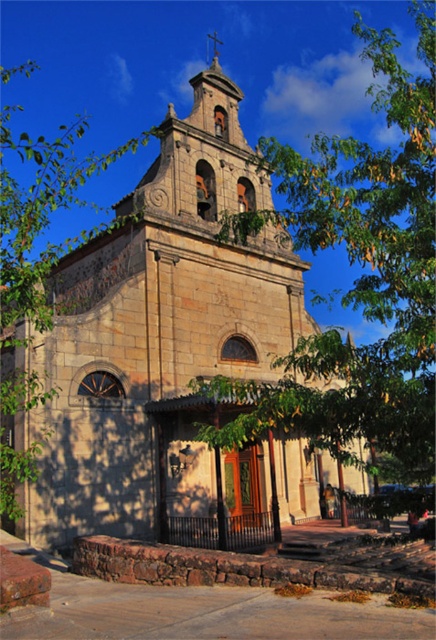
Who is taller, green leafy tree at center or green leafy tree at left?

With more height is green leafy tree at center.

Is green leafy tree at center closer to camera compared to green leafy tree at left?

Yes.

Does point (290, 204) lie behind point (3, 316)?

Yes.

This screenshot has width=436, height=640. Find the location of `green leafy tree at center`. green leafy tree at center is located at coordinates (361, 275).

Does stone church at center appear on the left side of green leafy tree at center?

Yes, stone church at center is to the left of green leafy tree at center.

This screenshot has height=640, width=436. What are the coordinates of `stone church at center` in the screenshot? It's located at (155, 323).

This screenshot has height=640, width=436. I want to click on stone church at center, so click(x=155, y=323).

Based on the photo, does stone church at center lie in front of green leafy tree at left?

No, it is not.

The image size is (436, 640). What do you see at coordinates (155, 323) in the screenshot?
I see `stone church at center` at bounding box center [155, 323].

In order to click on stone church at center in this screenshot , I will do `click(155, 323)`.